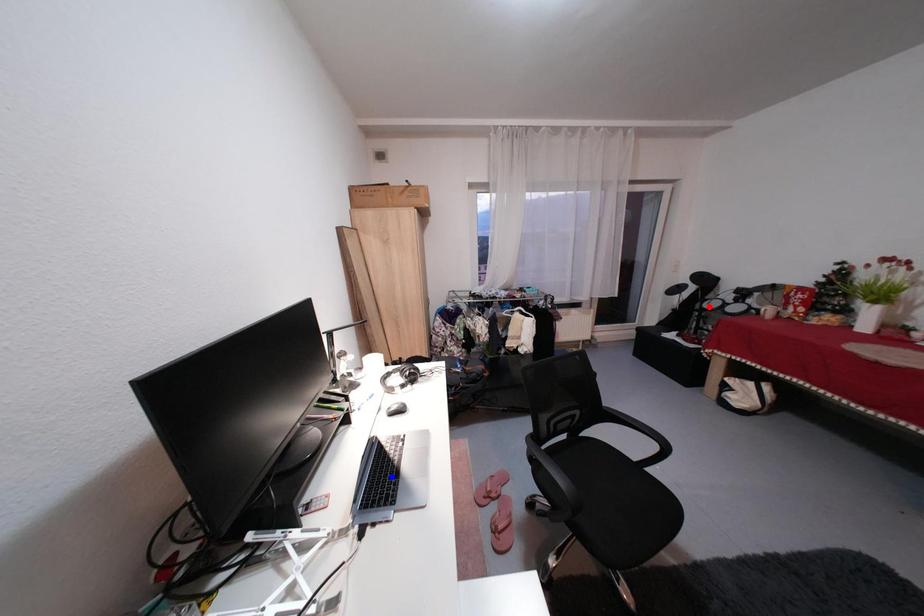
Question: In the image, two points are highlighted. Which point is nearer to the camera? Reply with the corresponding letter.

Choices:
 (A) blue point
 (B) red point

Answer: (A)